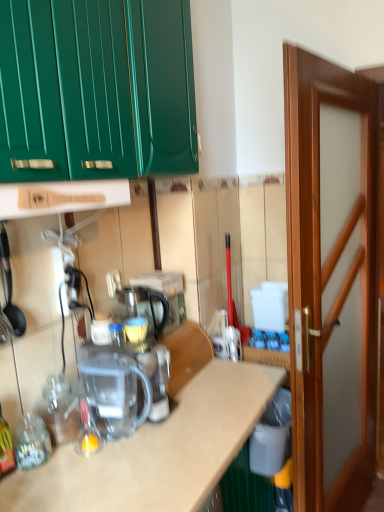
Question: Is the depth of translucent glass bottle at lower left, placed as the first bottle when sorted from front to back, greater than that of wooden at center?

Choices:
 (A) yes
 (B) no

Answer: (B)

Question: Does translucent glass bottle at lower left, placed as the first bottle when sorted from front to back, have a larger size compared to wooden at center?

Choices:
 (A) yes
 (B) no

Answer: (B)

Question: Considering the relative sizes of translucent glass bottle at lower left, marked as the second bottle in a right-to-left arrangement, and wooden at center in the image provided, is translucent glass bottle at lower left, marked as the second bottle in a right-to-left arrangement, smaller than wooden at center?

Choices:
 (A) no
 (B) yes

Answer: (B)

Question: Is translucent glass bottle at lower left, the first bottle when ordered from left to right, at the right side of wooden at center?

Choices:
 (A) yes
 (B) no

Answer: (B)

Question: Is translucent glass bottle at lower left, placed as the first bottle when sorted from front to back, thinner than wooden at center?

Choices:
 (A) no
 (B) yes

Answer: (B)

Question: Can you confirm if translucent glass bottle at lower left, placed as the first bottle when sorted from front to back, is shorter than wooden at center?

Choices:
 (A) no
 (B) yes

Answer: (B)

Question: Is translucent glass bottle at lower left, which is the second bottle from back to front, next to transparent plastic kettle at center and touching it?

Choices:
 (A) yes
 (B) no

Answer: (B)

Question: Is translucent glass bottle at lower left, the first bottle when ordered from left to right, completely or partially outside of transparent plastic kettle at center?

Choices:
 (A) yes
 (B) no

Answer: (A)

Question: Is translucent glass bottle at lower left, placed as the first bottle when sorted from front to back, smaller than transparent plastic kettle at center?

Choices:
 (A) no
 (B) yes

Answer: (B)

Question: Considering the relative sizes of translucent glass bottle at lower left, the first bottle when ordered from left to right, and transparent plastic kettle at center in the image provided, is translucent glass bottle at lower left, the first bottle when ordered from left to right, thinner than transparent plastic kettle at center?

Choices:
 (A) no
 (B) yes

Answer: (B)

Question: Is translucent glass bottle at lower left, placed as the first bottle when sorted from front to back, oriented towards transparent plastic kettle at center?

Choices:
 (A) yes
 (B) no

Answer: (B)

Question: Can you confirm if translucent glass bottle at lower left, which is the second bottle from back to front, is wider than transparent plastic kettle at center?

Choices:
 (A) yes
 (B) no

Answer: (B)

Question: From a real-world perspective, does transparent plastic coffee machine at center stand above wooden door at right?

Choices:
 (A) no
 (B) yes

Answer: (A)